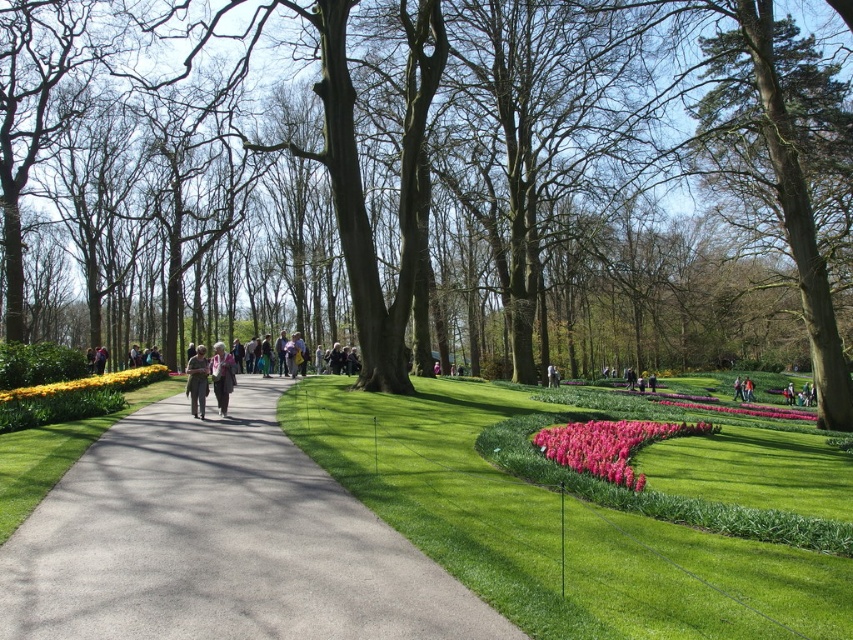
Question: Is yellow matte flowers at left bigger than matte gray jacket at center?

Choices:
 (A) yes
 (B) no

Answer: (B)

Question: Which of these objects is positioned closest to the gray asphalt path at center?

Choices:
 (A) yellow matte flowers at left
 (B) matte gray jacket at center
 (C) light brown leather jacket at center

Answer: (B)

Question: Does gray asphalt path at center have a larger size compared to pink matte flower at center-right?

Choices:
 (A) no
 (B) yes

Answer: (A)

Question: Which point appears farthest from the camera in this image?

Choices:
 (A) (265, 548)
 (B) (738, 380)
 (C) (215, 371)
 (D) (196, 380)

Answer: (B)

Question: Does pink glossy flower at center appear over light brown leather jacket at center?

Choices:
 (A) yes
 (B) no

Answer: (A)

Question: Which point is farther from the camera taking this photo?

Choices:
 (A) (737, 396)
 (B) (225, 372)
 (C) (341, 582)
 (D) (682, 17)

Answer: (A)